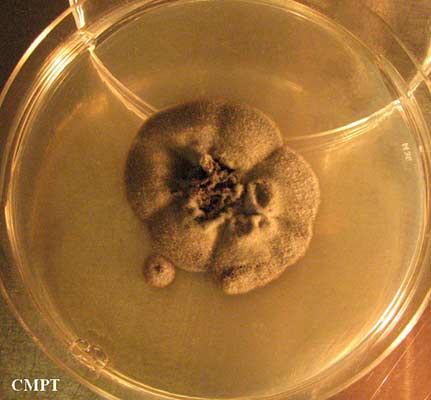
The height and width of the screenshot is (400, 431). In order to click on floor in this screenshot , I will do `click(26, 365)`.